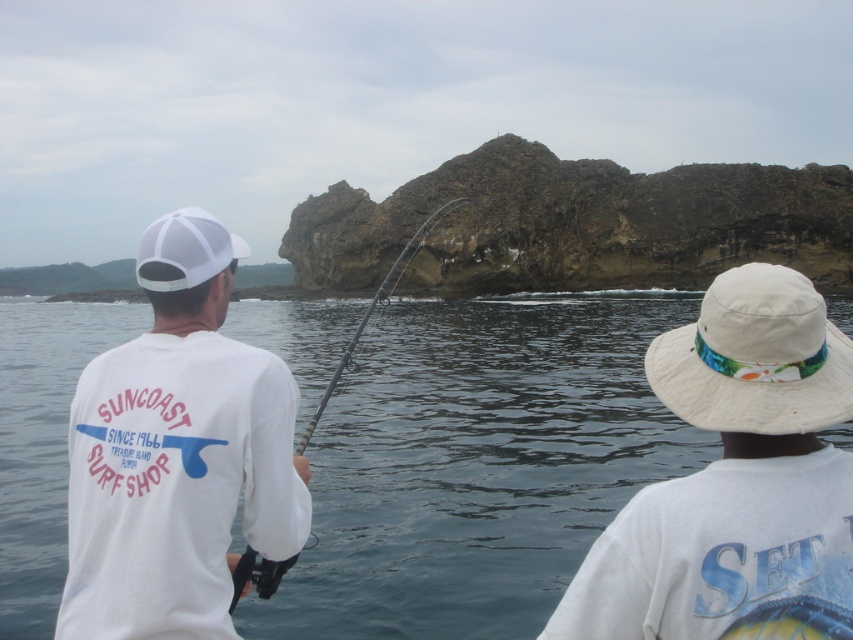
Based on the scene description, can you determine which object is closer to the viewer between the white fabric hat at upper right and the black textured fishing pole at center?

The white fabric hat at upper right is positioned under the black textured fishing pole at center, meaning the black textured fishing pole at center is closer to the viewer.

What is located at the coordinates point (x=479, y=464) in the image?

At point (x=479, y=464) lies clear water at center.